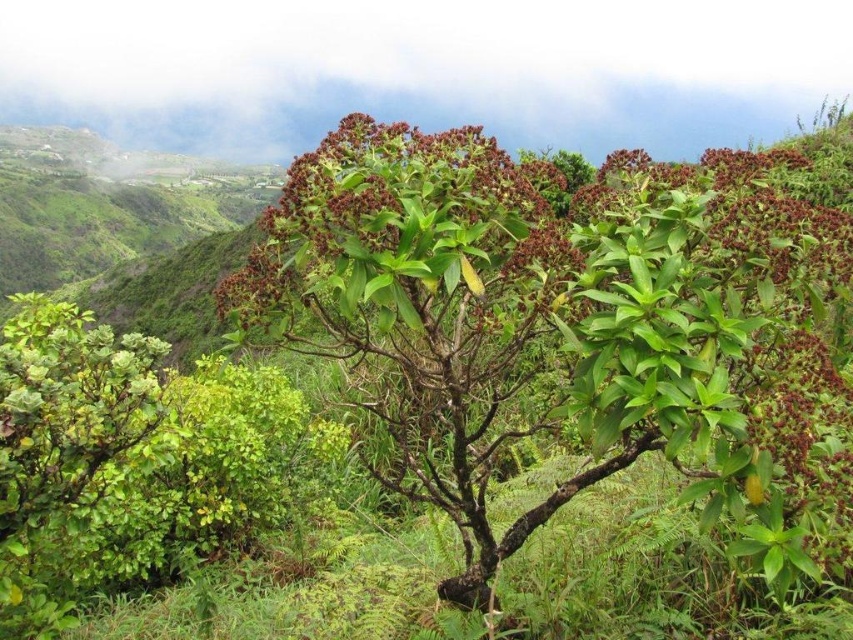
This screenshot has height=640, width=853. Describe the element at coordinates (506, 324) in the screenshot. I see `green leafy shrub at center` at that location.

Is green leafy shrub at center taller than brown matte flower at center?

No.

Is point (310, 163) closer to camera compared to point (795, 193)?

Yes, point (310, 163) is in front of point (795, 193).

Where is `green leafy shrub at center`? green leafy shrub at center is located at coordinates (506, 324).